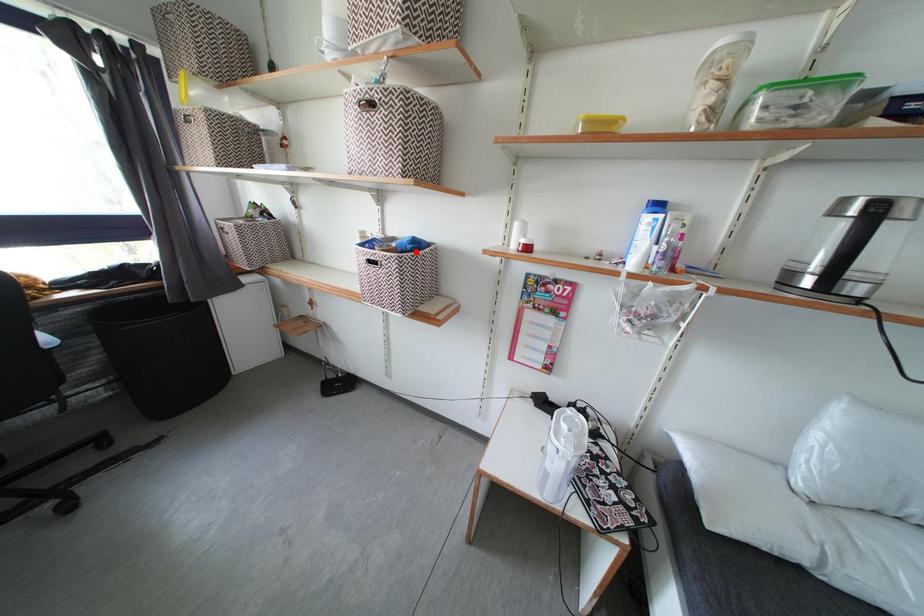
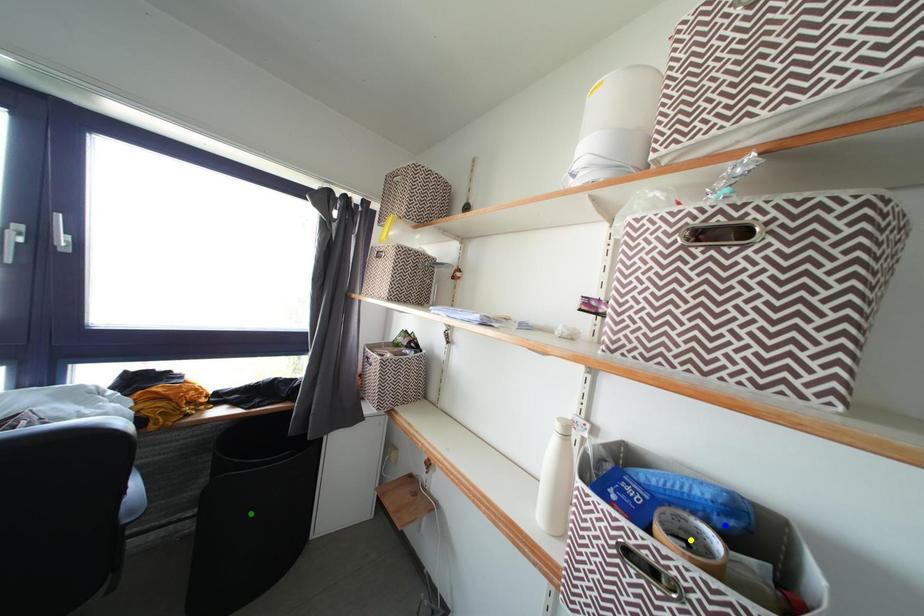
Question: I am providing you with two images of the same scene from different viewpoints. A red point is marked on the first image. You are given multiple points on the second image. Which spot in image 2 lines up with the point in image 1?

Choices:
 (A) blue point
 (B) yellow point
 (C) green point

Answer: (A)